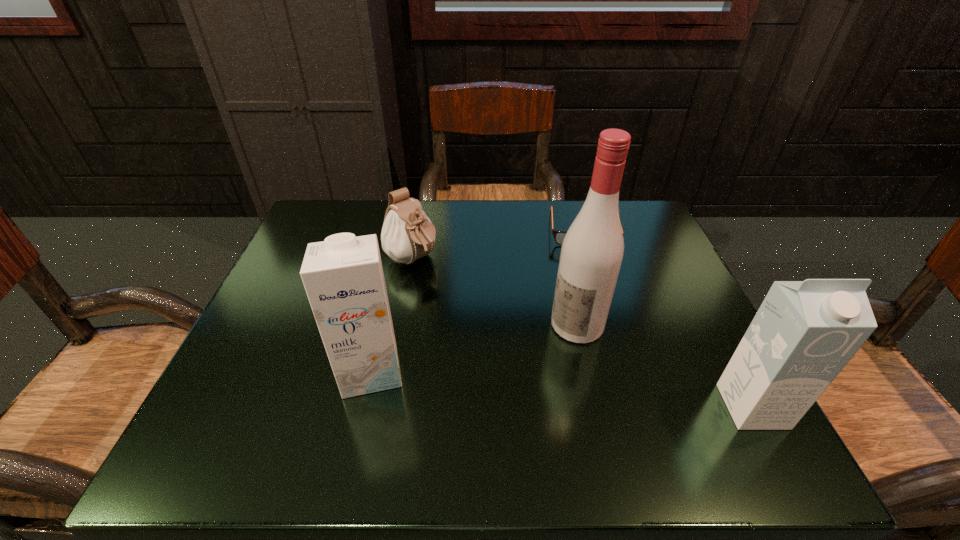
In order to click on free space on the desktop that is between the left carton and the rightmost object and is positioned on the front-facing side of the spectacles in this screenshot , I will do `click(602, 392)`.

You are a GUI agent. You are given a task and a screenshot of the screen. Output one action in this format:
    pyautogui.click(x=<x>, y=<y>)
    Task: Click on the vacant spot on the desktop that is between the left carton and the right carton and is positioned on the label of the alcohol
    The height and width of the screenshot is (540, 960).
    Given the screenshot: What is the action you would take?
    pyautogui.click(x=503, y=382)

At what (x,y) coordinates should I click in order to perform the action: click on vacant space on the desktop that is between the left carton and the rightmost object and is positioned on the front-facing side of the pouch. Please return your answer as a coordinate pair (x, y). Image resolution: width=960 pixels, height=540 pixels. Looking at the image, I should click on (585, 390).